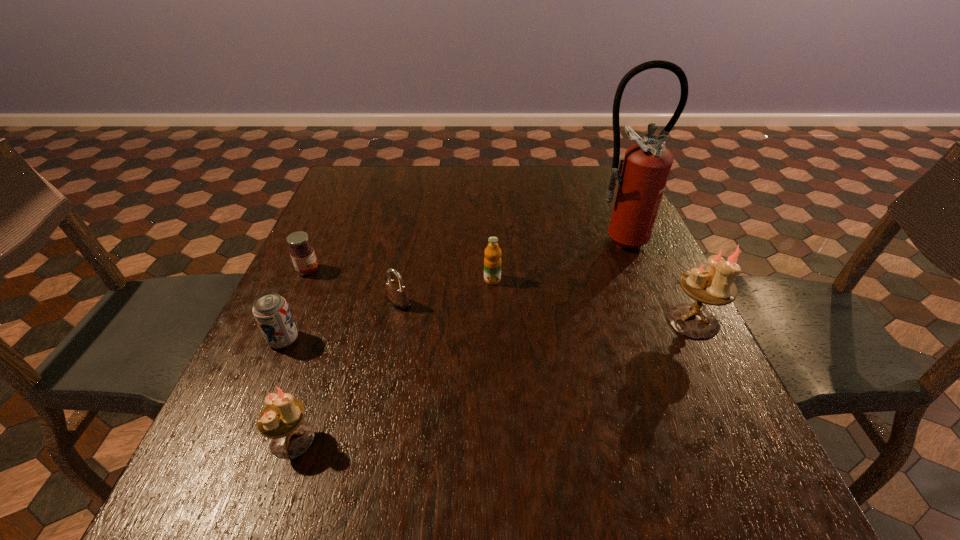
Identify the location of vacant space positioned on the back of the third object from left to right. Image resolution: width=960 pixels, height=540 pixels. (343, 293).

Where is `free space located on the left of the farther candle holder`? free space located on the left of the farther candle holder is located at coordinates (479, 321).

Find the location of `vacant area located 0.050m on the left of the fourth object from right to left`. vacant area located 0.050m on the left of the fourth object from right to left is located at coordinates (363, 303).

What are the coordinates of `free space located 0.340m at the nozzle of the tallest object` in the screenshot? It's located at (664, 363).

Locate an element on the screen. vacant space located 0.400m on the label side of the jam is located at coordinates (486, 271).

Locate an element on the screen. vacant space positioned 0.390m on the label of the fifth object from left to right is located at coordinates (497, 444).

Find the location of `vacant space situated 0.200m on the right of the beer can`. vacant space situated 0.200m on the right of the beer can is located at coordinates (397, 340).

Where is `object that is positioned at the near edge`? The image size is (960, 540). object that is positioned at the near edge is located at coordinates (281, 420).

Find the location of a particular element. candle holder at the left edge is located at coordinates (281, 420).

What are the coordinates of `jam present at the left edge` in the screenshot? It's located at (302, 253).